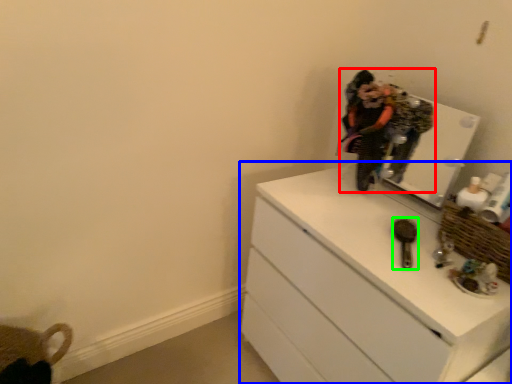
Question: Estimate the real-world distances between objects in this image. Which object is closer to person (highlighted by a red box), chest of drawers (highlighted by a blue box) or brush (highlighted by a green box)?

Choices:
 (A) chest of drawers
 (B) brush

Answer: (B)